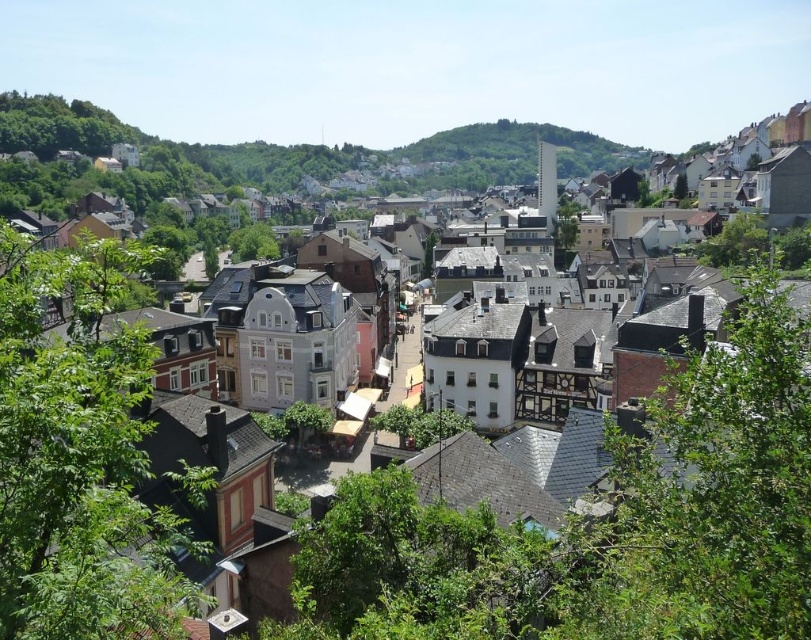
You are planning to place a bench between the green leafy tree at lower right and the green leafy tree at lower left. Which tree has a narrower trunk to leave more space for the bench?

The green leafy tree at lower right has a narrower trunk, so placing the bench near it would leave more space.

You are standing at the viewpoint overlooking the town and want to determine which of the two points, point (x=88, y=483) or point (x=239, y=257), is nearer to you. Based on the scene, which point is closer?

Point (x=88, y=483) is closer to the viewer than point (x=239, y=257).